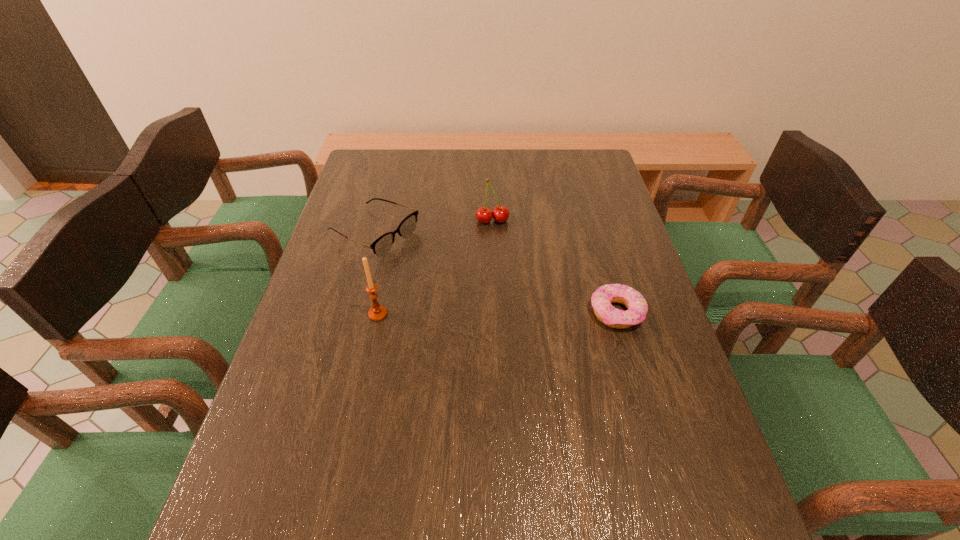
The image size is (960, 540). What are the coordinates of `vacant space on the desktop that is between the tallest object and the shortest object and is positioned with the stems of the third object from left to right pointing upwards` in the screenshot? It's located at (514, 313).

This screenshot has width=960, height=540. I want to click on free space on the desktop that is between the candle_holder and the shortest object and is positioned on the face of the spectacles, so (533, 313).